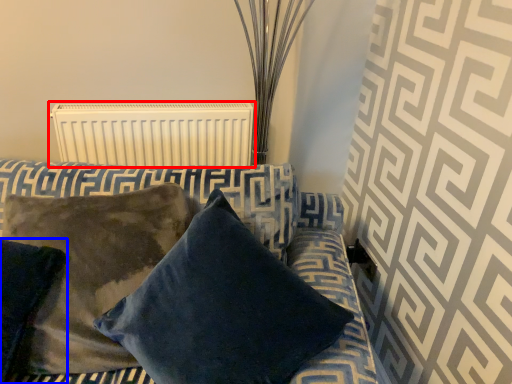
Question: Among these objects, which one is farthest to the camera, radiator (highlighted by a red box) or pillow (highlighted by a blue box)?

Choices:
 (A) radiator
 (B) pillow

Answer: (A)